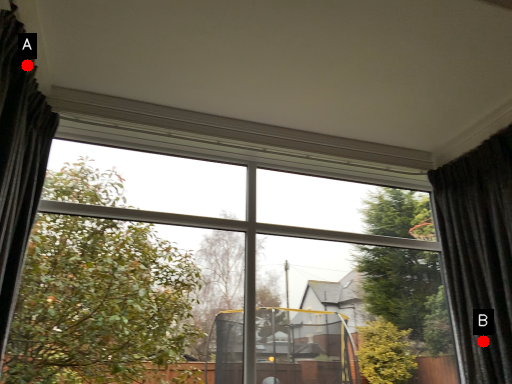
Question: Two points are circled on the image, labeled by A and B beside each circle. Which point is closer to the camera taking this photo?

Choices:
 (A) A is closer
 (B) B is closer

Answer: (A)